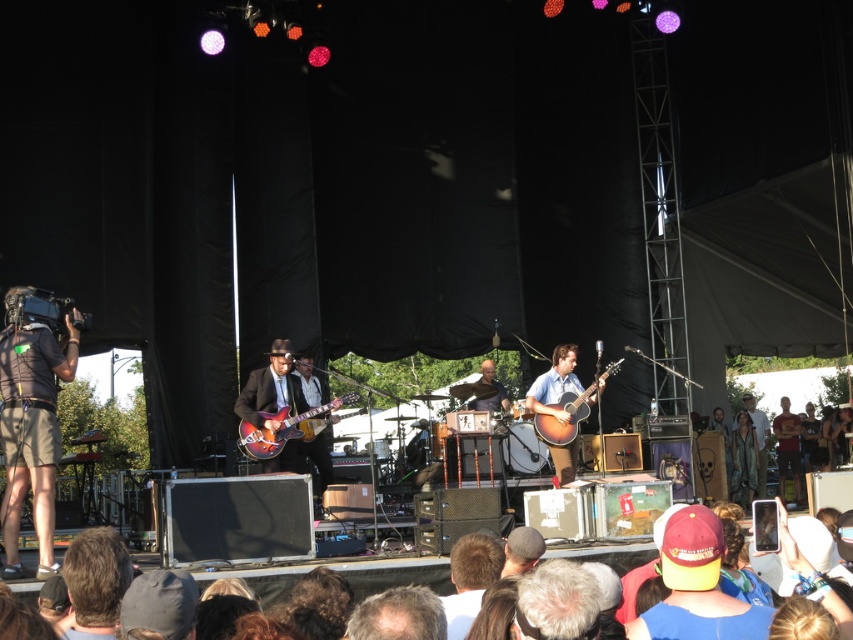
Question: Where is light brown leather jacket at center located in relation to matte brown guitar at center in the image?

Choices:
 (A) right
 (B) left

Answer: (A)

Question: Based on their relative distances, which object is farther from the light brown leather jacket at center?

Choices:
 (A) maroon fabric cap at lower right
 (B) green velvet jacket at lower right

Answer: (A)

Question: Which point is closer to the camera?

Choices:
 (A) green velvet jacket at lower right
 (B) maroon fabric cap at lower right

Answer: (B)

Question: Based on their relative distances, which object is nearer to the glossy wood electric guitar at center?

Choices:
 (A) maroon fabric cap at lower right
 (B) black fabric camera at left

Answer: (B)

Question: Does brown hair at lower left have a lesser width compared to matte brown guitar at center?

Choices:
 (A) yes
 (B) no

Answer: (A)

Question: Can you confirm if maroon fabric cap at lower right is wider than glossy wood electric guitar at center?

Choices:
 (A) no
 (B) yes

Answer: (A)